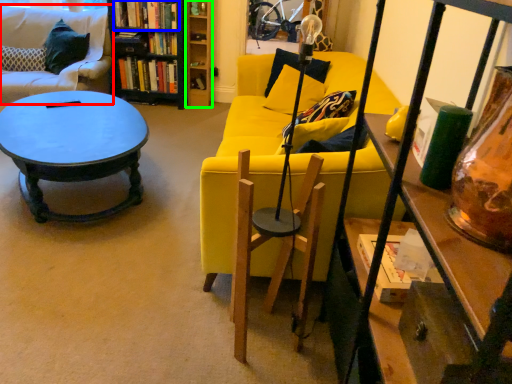
Question: Which object is positioned farthest from studio couch (highlighted by a red box)? Select from book (highlighted by a blue box) and shelf (highlighted by a green box).

Choices:
 (A) book
 (B) shelf

Answer: (B)